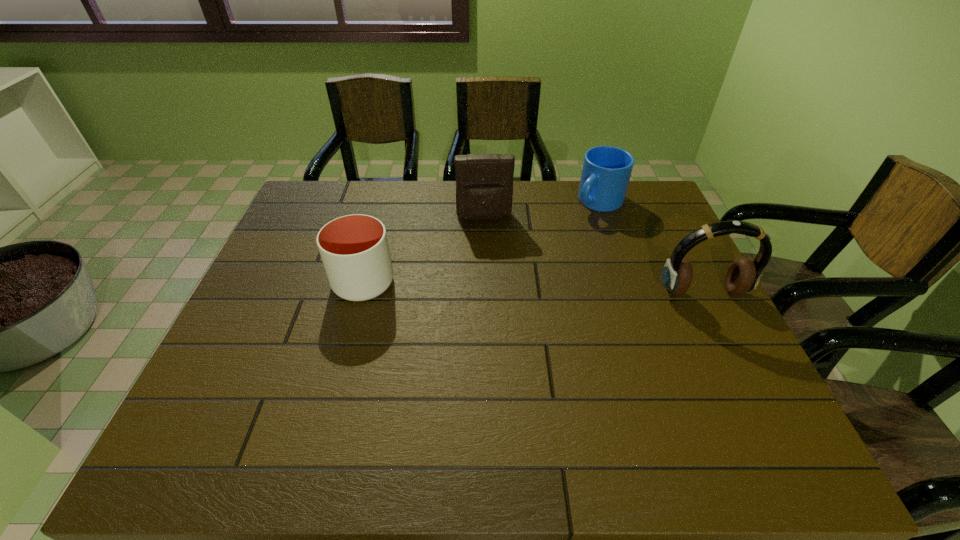
Where is `blank area located 0.060m with an open flap on the pouch`? The width and height of the screenshot is (960, 540). blank area located 0.060m with an open flap on the pouch is located at coordinates (488, 237).

Identify the location of vacant space positioned with an open flap on the pouch. This screenshot has height=540, width=960. (493, 284).

Locate an element on the screen. mug that is at the far edge is located at coordinates (606, 172).

This screenshot has height=540, width=960. Find the location of `pouch that is at the far edge`. pouch that is at the far edge is located at coordinates coord(484,182).

The height and width of the screenshot is (540, 960). What are the coordinates of `headset that is at the right edge` in the screenshot? It's located at (744, 274).

Where is `mug present at the right edge`? This screenshot has width=960, height=540. mug present at the right edge is located at coordinates (606, 172).

The width and height of the screenshot is (960, 540). I want to click on object at the far right corner, so click(x=606, y=172).

Where is `vacant region at the far edge of the desktop`? Image resolution: width=960 pixels, height=540 pixels. vacant region at the far edge of the desktop is located at coordinates (454, 185).

Where is `free spot at the left edge of the desktop`? Image resolution: width=960 pixels, height=540 pixels. free spot at the left edge of the desktop is located at coordinates (283, 232).

Locate an element on the screen. This screenshot has height=540, width=960. free location at the right edge of the desktop is located at coordinates (626, 228).